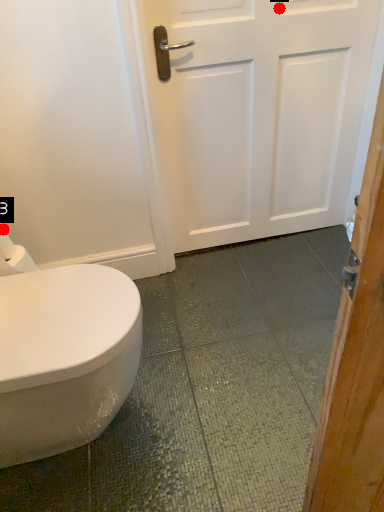
Question: Two points are circled on the image, labeled by A and B beside each circle. Among these points, which one is farthest from the camera?

Choices:
 (A) A is further
 (B) B is further

Answer: (A)